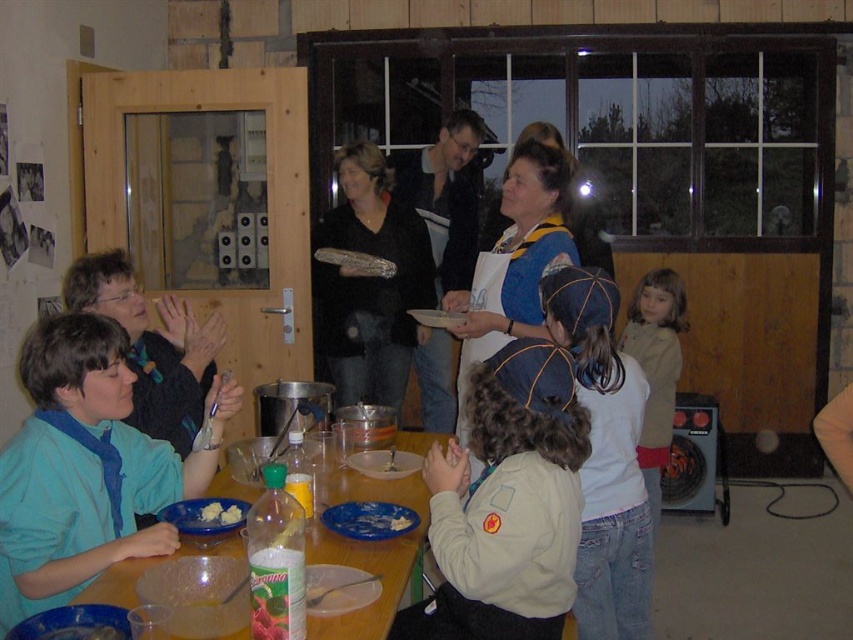
Can you confirm if khaki uniform at center is thinner than matte black sweater at center?

Yes.

Locate an element on the screen. The height and width of the screenshot is (640, 853). khaki uniform at center is located at coordinates (506, 502).

Can you confirm if matte black apron at center is positioned above light brown hair at right?

Indeed, matte black apron at center is positioned over light brown hair at right.

Between matte black apron at center and light brown hair at right, which one has less height?

Standing shorter between the two is light brown hair at right.

The width and height of the screenshot is (853, 640). I want to click on matte black apron at center, so click(445, 196).

Is wooden table at center positioned at the back of matte black apron at center?

That is False.

Which is more to the right, wooden table at center or matte black apron at center?

Positioned to the right is matte black apron at center.

In order to click on wooden table at center in this screenshot , I will do `click(366, 552)`.